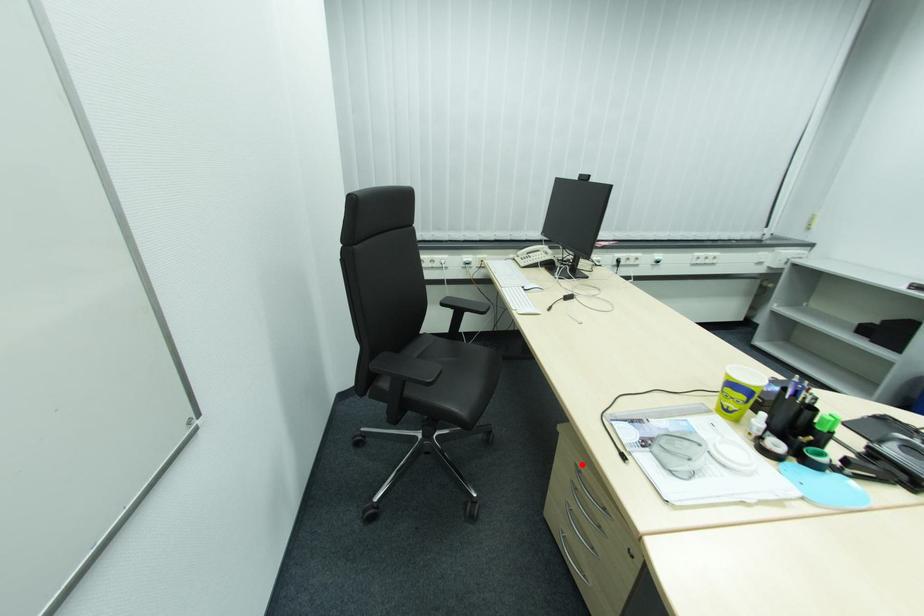
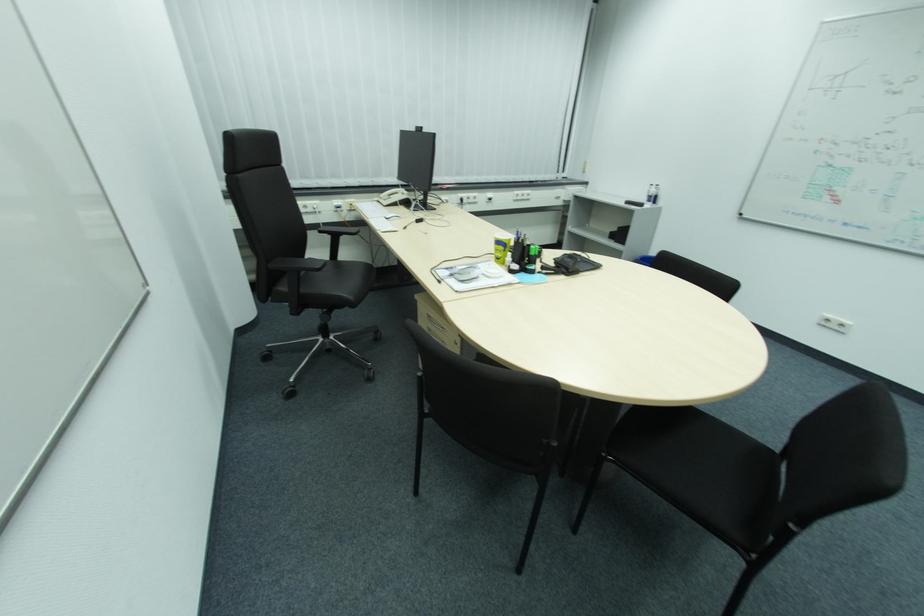
Locate, in the second image, the point that corresponds to the highlighted location in the first image.

(433, 315)